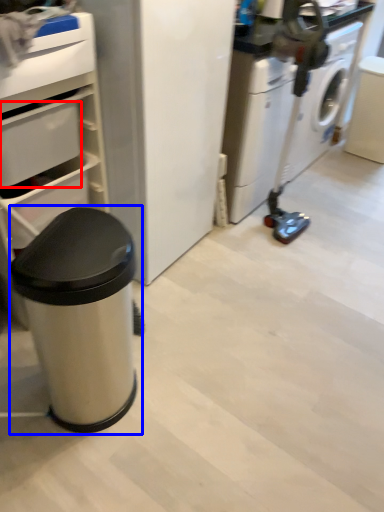
Question: Which object appears farthest to the camera in this image, drawer (highlighted by a red box) or waste container (highlighted by a blue box)?

Choices:
 (A) drawer
 (B) waste container

Answer: (A)